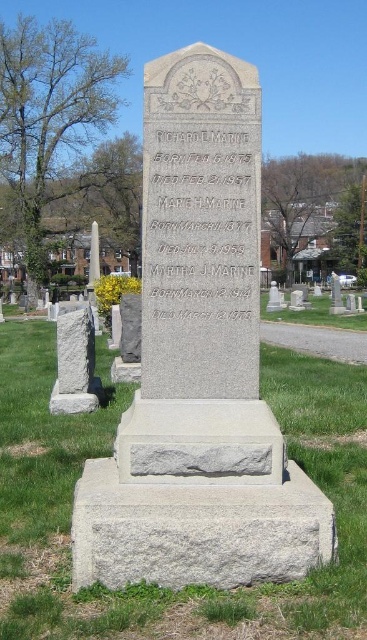
Question: Which object is positioned closest to the gray stone inscription at center?

Choices:
 (A) gray stone marker at left
 (B) green grass at center

Answer: (B)

Question: Does gray granite monument at center appear on the left side of gray stone inscription at center?

Choices:
 (A) yes
 (B) no

Answer: (A)

Question: Is green grass at center thinner than gray stone marker at left?

Choices:
 (A) no
 (B) yes

Answer: (A)

Question: Which point is farther from the camera taking this photo?

Choices:
 (A) (361, 436)
 (B) (233, 257)
 (C) (201, 136)
 (D) (66, 364)

Answer: (D)

Question: Is green grass at center wider than gray stone inscription at center?

Choices:
 (A) no
 (B) yes

Answer: (B)

Question: Considering the real-world distances, which object is closest to the gray stone inscription at center?

Choices:
 (A) green grass at center
 (B) gray stone marker at left
 (C) gray granite monument at center

Answer: (C)